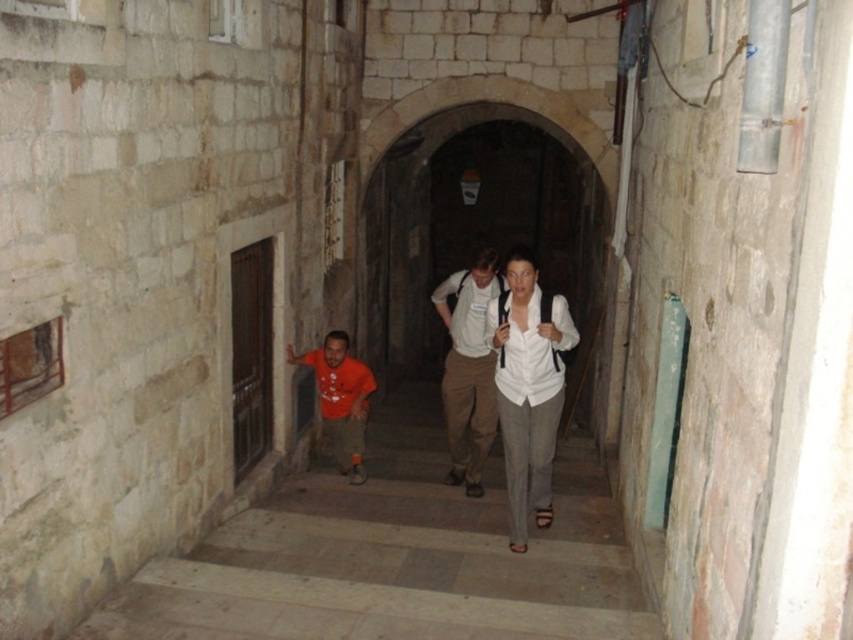
Question: Considering the real-world distances, which object is closest to the stone archway at center?

Choices:
 (A) white matte shirt at center
 (B) orange t-shirt at center

Answer: (A)

Question: From the image, what is the correct spatial relationship of orange t-shirt at center in relation to matte orange t-shirt at lower center?

Choices:
 (A) right
 (B) left

Answer: (A)

Question: Which point is farther to the camera?

Choices:
 (A) matte orange t-shirt at lower center
 (B) stone archway at center
 (C) white matte shirt at center

Answer: (B)

Question: Is white matte shirt at center wider than stone archway at center?

Choices:
 (A) no
 (B) yes

Answer: (A)

Question: Does orange t-shirt at center appear on the left side of stone archway at center?

Choices:
 (A) yes
 (B) no

Answer: (A)

Question: Which is nearer to the orange t-shirt at center?

Choices:
 (A) white matte shirt at center
 (B) white cotton shirt at center
 (C) stone archway at center
 (D) matte orange t-shirt at lower center

Answer: (A)